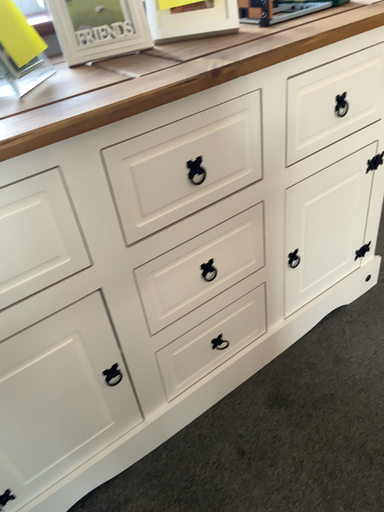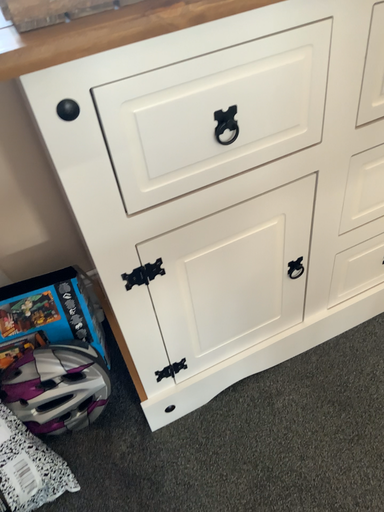
Question: Which way did the camera rotate in the video?

Choices:
 (A) rotated downward
 (B) rotated upward

Answer: (A)